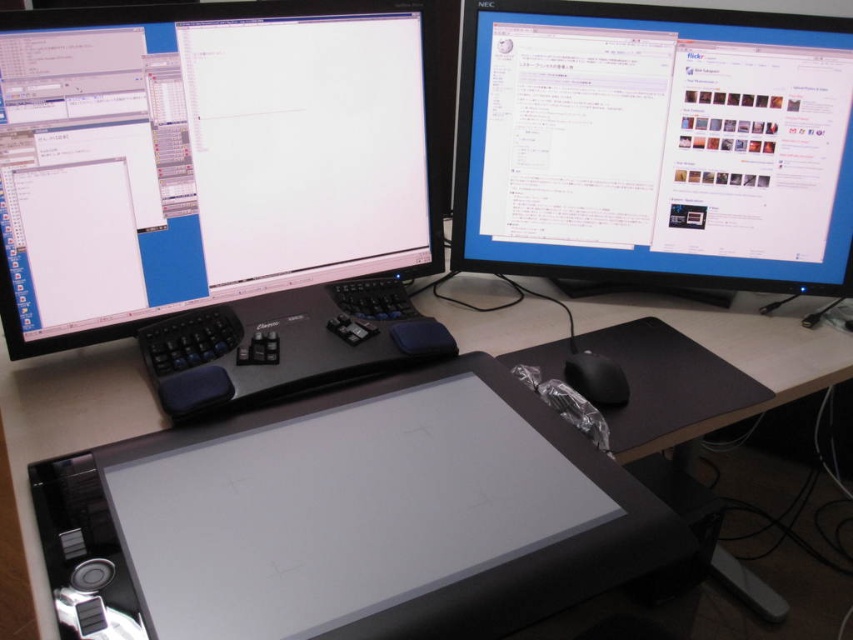
Question: Which of the following is the closest to the observer?

Choices:
 (A) matte black monitor at upper right
 (B) black matte keyboard at center
 (C) black plastic computer desk at center

Answer: (B)

Question: Does black matte keyboard at center have a lesser width compared to black matte mouse at lower right?

Choices:
 (A) yes
 (B) no

Answer: (B)

Question: Does matte black monitor at upper left appear on the right side of black matte keyboard at center?

Choices:
 (A) yes
 (B) no

Answer: (B)

Question: In this image, where is matte black monitor at upper left located relative to matte black monitor at upper right?

Choices:
 (A) above
 (B) below

Answer: (B)

Question: Which of the following is the farthest from the observer?

Choices:
 (A) matte black monitor at upper right
 (B) black matte keyboard at center

Answer: (A)

Question: Estimate the real-world distances between objects in this image. Which object is closer to the black matte mouse at lower right?

Choices:
 (A) black matte keyboard at center
 (B) matte black monitor at upper right
 (C) matte black monitor at upper left

Answer: (A)